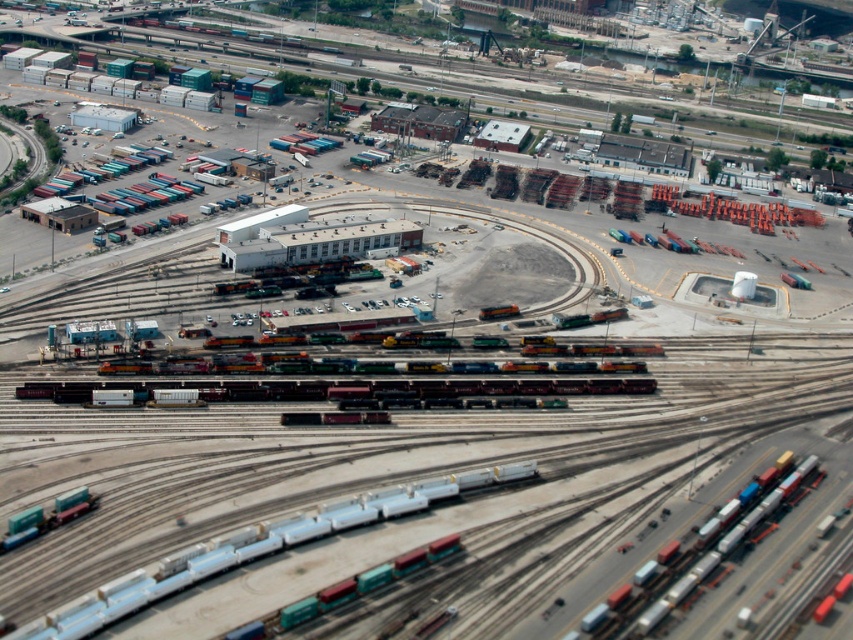
Question: Which of the following is the closest to the observer?

Choices:
 (A) green matte train car at lower left
 (B) metallic blue train car at bottom left

Answer: (B)

Question: Which point is farther to the camera?

Choices:
 (A) (173, 362)
 (B) (84, 508)
 (C) (496, 445)

Answer: (A)

Question: Does shiny metallic train at center appear over green matte train car at lower left?

Choices:
 (A) no
 (B) yes

Answer: (B)

Question: Among these objects, which one is farthest from the camera?

Choices:
 (A) green matte train car at center
 (B) metallic freight train tracks at center
 (C) metallic blue train car at bottom left

Answer: (A)

Question: Is green matte train car at center wider than green matte train car at lower left?

Choices:
 (A) yes
 (B) no

Answer: (A)

Question: Can you confirm if metallic blue train car at bottom left is positioned above metallic silver train at lower right?

Choices:
 (A) yes
 (B) no

Answer: (A)